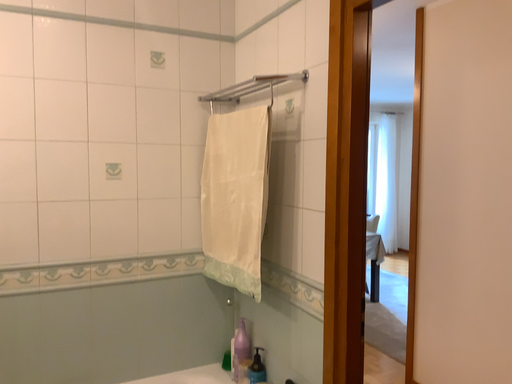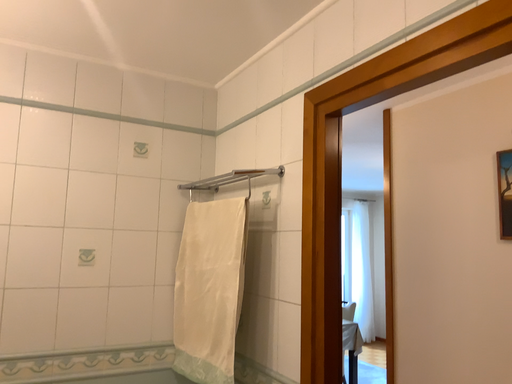
Question: How did the camera likely rotate when shooting the video?

Choices:
 (A) rotated upward
 (B) rotated downward

Answer: (A)